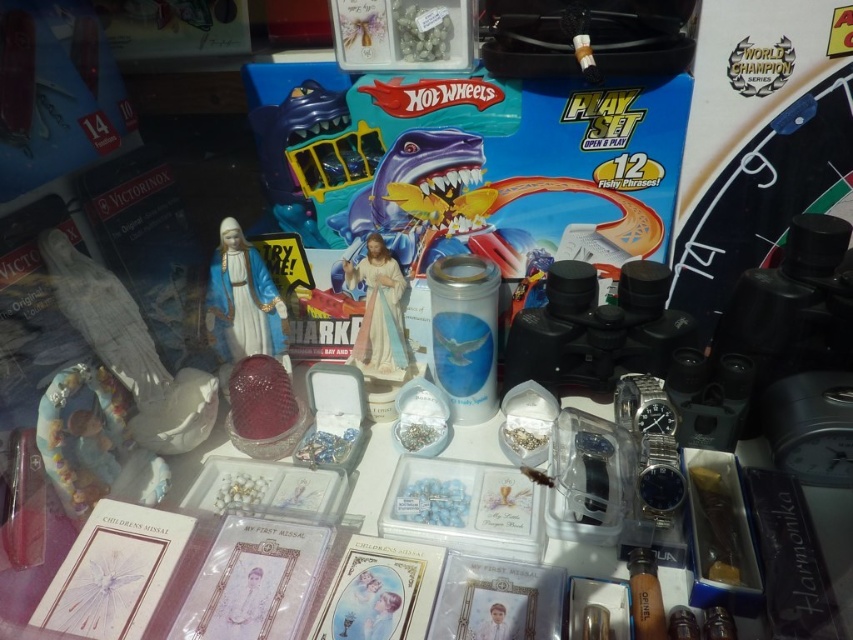
Question: Which object is closer to the camera taking this photo?

Choices:
 (A) matte porcelain statue at center
 (B) matte porcelain statue at center-left

Answer: (B)

Question: Is matte porcelain statue at center-left thinner than matte porcelain statue at center?

Choices:
 (A) yes
 (B) no

Answer: (B)

Question: Is matte porcelain statue at center-left positioned at the back of matte porcelain statue at center?

Choices:
 (A) no
 (B) yes

Answer: (A)

Question: Can you confirm if matte porcelain statue at center-left is bigger than matte porcelain statue at center?

Choices:
 (A) no
 (B) yes

Answer: (A)

Question: Which point is closer to the camera?

Choices:
 (A) matte porcelain statue at center-left
 (B) matte porcelain statue at center

Answer: (A)

Question: Which of the following is the farthest from the observer?

Choices:
 (A) matte porcelain statue at center
 (B) matte porcelain statue at center-left

Answer: (A)